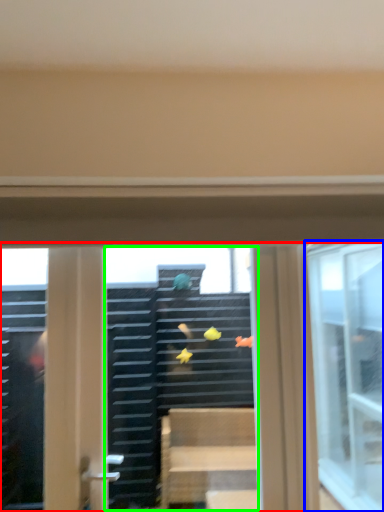
Question: Estimate the real-world distances between objects in this image. Which object is farther from window (highlighted by a red box), window (highlighted by a blue box) or shop window (highlighted by a green box)?

Choices:
 (A) window
 (B) shop window

Answer: (A)